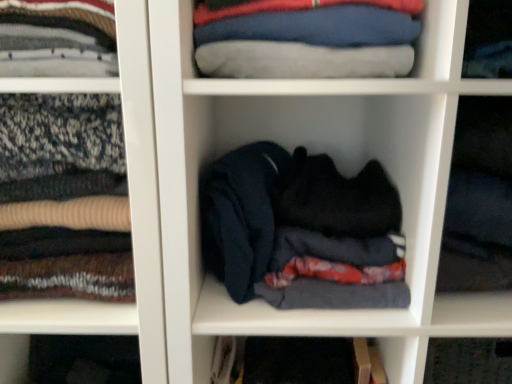
The height and width of the screenshot is (384, 512). Describe the element at coordinates (307, 39) in the screenshot. I see `blue cotton shirt at upper center` at that location.

Locate an element on the screen. This screenshot has height=384, width=512. blue cotton shirt at upper center is located at coordinates (307, 39).

Are black fabric at center, which is counted as the first cabinet, starting from the right, and dark blue fabric at center, which ranks as the 1th cabinet in left-to-right order, located far from each other?

No.

Is point (510, 120) less distant than point (88, 303)?

Yes, it is in front of point (88, 303).

How many degrees apart are the facing directions of black fabric at center, placed as the third cabinet when sorted from left to right, and dark blue fabric at center, which ranks as the 1th cabinet in left-to-right order?

1.63 degrees.

Image resolution: width=512 pixels, height=384 pixels. I want to click on the 1st cabinet behind the dark blue fabric at center, the third cabinet viewed from the right, starting your count from the anchor, so click(479, 199).

From the image's perspective, relative to dark fabric at center, marked as the second cabinet in a left-to-right arrangement, is dark blue fabric at center, which ranks as the 1th cabinet in left-to-right order, above or below?

Clearly, from the image's perspective, dark blue fabric at center, which ranks as the 1th cabinet in left-to-right order, is below dark fabric at center, marked as the second cabinet in a left-to-right arrangement.

Based on the photo, how far apart are dark blue fabric at center, which ranks as the 1th cabinet in left-to-right order, and dark fabric at center, which ranks as the 2th cabinet in right-to-left order?

They are 12.93 inches apart.

Based on the photo, from a real-world perspective, is dark blue fabric at center, which ranks as the 1th cabinet in left-to-right order, above or below dark fabric at center, marked as the second cabinet in a left-to-right arrangement?

Clearly, from a real-world perspective, dark blue fabric at center, which ranks as the 1th cabinet in left-to-right order, is below dark fabric at center, marked as the second cabinet in a left-to-right arrangement.

Which is more to the left, dark fabric at center, marked as the second cabinet in a left-to-right arrangement, or blue cotton shirt at upper center?

blue cotton shirt at upper center is more to the left.

Is dark fabric at center, which ranks as the 2th cabinet in right-to-left order, positioned behind blue cotton shirt at upper center?

Yes, dark fabric at center, which ranks as the 2th cabinet in right-to-left order, is further from the viewer.

Is point (434, 273) positioned behind point (270, 45)?

Yes.

Between dark fabric at center, which ranks as the 2th cabinet in right-to-left order, and blue cotton shirt at upper center, which one has smaller width?

blue cotton shirt at upper center.

Is dark blue fabric at center, the third cabinet viewed from the right, surrounding blue cotton shirt at upper center?

That's incorrect, blue cotton shirt at upper center is not inside dark blue fabric at center, the third cabinet viewed from the right.

Between dark blue fabric at center, the third cabinet viewed from the right, and blue cotton shirt at upper center, which one has more height?

With more height is dark blue fabric at center, the third cabinet viewed from the right.

Does dark blue fabric at center, the third cabinet viewed from the right, lie in front of blue cotton shirt at upper center?

That is True.

In terms of height, does black fabric at center, which is counted as the first cabinet, starting from the right, look taller or shorter compared to dark fabric at center, marked as the second cabinet in a left-to-right arrangement?

In the image, black fabric at center, which is counted as the first cabinet, starting from the right, appears to be taller than dark fabric at center, marked as the second cabinet in a left-to-right arrangement.

Is black fabric at center, placed as the third cabinet when sorted from left to right, far away from dark fabric at center, which ranks as the 2th cabinet in right-to-left order?

black fabric at center, placed as the third cabinet when sorted from left to right, is near dark fabric at center, which ranks as the 2th cabinet in right-to-left order, not far away.

In the scene shown: Does black fabric at center, placed as the third cabinet when sorted from left to right, have a larger size compared to dark fabric at center, which ranks as the 2th cabinet in right-to-left order?

Incorrect, black fabric at center, placed as the third cabinet when sorted from left to right, is not larger than dark fabric at center, which ranks as the 2th cabinet in right-to-left order.

From the picture: From a real-world perspective, who is located lower, black fabric at center, placed as the third cabinet when sorted from left to right, or blue cotton shirt at upper center?

In real-world perspective, black fabric at center, placed as the third cabinet when sorted from left to right, is lower.

How much distance is there between black fabric at center, placed as the third cabinet when sorted from left to right, and blue cotton shirt at upper center?

black fabric at center, placed as the third cabinet when sorted from left to right, is 9.95 inches from blue cotton shirt at upper center.

At what (x,y) coordinates should I click in order to perform the action: click on the 2nd cabinet to the right of the blue cotton shirt at upper center, counting from the anchor's position. Please return your answer as a coordinate pair (x, y). The height and width of the screenshot is (384, 512). Looking at the image, I should click on (479, 199).

Which object is closer to the camera taking this photo, black fabric at center, placed as the third cabinet when sorted from left to right, or blue cotton shirt at upper center?

Positioned in front is black fabric at center, placed as the third cabinet when sorted from left to right.

Between blue cotton shirt at upper center and dark blue fabric at center, which ranks as the 1th cabinet in left-to-right order, which one has less height?

blue cotton shirt at upper center.

Is blue cotton shirt at upper center turned away from dark blue fabric at center, the third cabinet viewed from the right?

→ That's not correct — blue cotton shirt at upper center is not looking away from dark blue fabric at center, the third cabinet viewed from the right.

In the scene shown: Is blue cotton shirt at upper center positioned far away from dark blue fabric at center, which ranks as the 1th cabinet in left-to-right order?

No, blue cotton shirt at upper center is not far away from dark blue fabric at center, which ranks as the 1th cabinet in left-to-right order.

Where is `the 2nd cabinet counting from the right of the dark blue fabric at center, the third cabinet viewed from the right`? the 2nd cabinet counting from the right of the dark blue fabric at center, the third cabinet viewed from the right is located at coordinates (479, 199).

Identify the location of the 1st cabinet above the dark blue fabric at center, which ranks as the 1th cabinet in left-to-right order (from the image's perspective). click(x=347, y=174).

From the picture: Which object lies nearer to the anchor point dark blue fabric at center, which ranks as the 1th cabinet in left-to-right order, blue cotton shirt at upper center or dark fabric at center, which ranks as the 2th cabinet in right-to-left order?

blue cotton shirt at upper center lies closer to dark blue fabric at center, which ranks as the 1th cabinet in left-to-right order, than the other object.

From the picture: From the image, which object appears to be farther from dark blue fabric at center, the third cabinet viewed from the right, dark fabric at center, marked as the second cabinet in a left-to-right arrangement, or blue cotton shirt at upper center?

Based on the image, dark fabric at center, marked as the second cabinet in a left-to-right arrangement, appears to be further to dark blue fabric at center, the third cabinet viewed from the right.

Considering their positions, is black fabric at center, placed as the third cabinet when sorted from left to right, positioned closer to dark fabric at center, which ranks as the 2th cabinet in right-to-left order, than blue cotton shirt at upper center?

Among the two, black fabric at center, placed as the third cabinet when sorted from left to right, is located nearer to dark fabric at center, which ranks as the 2th cabinet in right-to-left order.

From the image, which object appears to be nearer to blue cotton shirt at upper center, black fabric at center, placed as the third cabinet when sorted from left to right, or dark blue fabric at center, which ranks as the 1th cabinet in left-to-right order?

The object closer to blue cotton shirt at upper center is dark blue fabric at center, which ranks as the 1th cabinet in left-to-right order.

Which object lies further to the anchor point blue cotton shirt at upper center, dark fabric at center, which ranks as the 2th cabinet in right-to-left order, or dark blue fabric at center, the third cabinet viewed from the right?

dark blue fabric at center, the third cabinet viewed from the right, is positioned further to the anchor blue cotton shirt at upper center.

Considering their positions, is dark blue fabric at center, the third cabinet viewed from the right, positioned closer to black fabric at center, which is counted as the first cabinet, starting from the right, than blue cotton shirt at upper center?

blue cotton shirt at upper center is closer to black fabric at center, which is counted as the first cabinet, starting from the right.

Looking at the image, which one is located further to blue cotton shirt at upper center, dark blue fabric at center, the third cabinet viewed from the right, or dark fabric at center, marked as the second cabinet in a left-to-right arrangement?

dark blue fabric at center, the third cabinet viewed from the right, is positioned further to the anchor blue cotton shirt at upper center.

Estimate the real-world distances between objects in this image. Which object is closer to black fabric at center, which is counted as the first cabinet, starting from the right, blue cotton shirt at upper center or dark fabric at center, which ranks as the 2th cabinet in right-to-left order?

Based on the image, dark fabric at center, which ranks as the 2th cabinet in right-to-left order, appears to be nearer to black fabric at center, which is counted as the first cabinet, starting from the right.

Identify the location of cabinet between dark blue fabric at center, which ranks as the 1th cabinet in left-to-right order, and black fabric at center, placed as the third cabinet when sorted from left to right. This screenshot has width=512, height=384. (347, 174).

Image resolution: width=512 pixels, height=384 pixels. I want to click on cabinet situated between blue cotton shirt at upper center and black fabric at center, which is counted as the first cabinet, starting from the right, from left to right, so click(347, 174).

Where is `clothing between dark blue fabric at center, which ranks as the 1th cabinet in left-to-right order, and dark fabric at center, marked as the second cabinet in a left-to-right arrangement, from left to right`? The image size is (512, 384). clothing between dark blue fabric at center, which ranks as the 1th cabinet in left-to-right order, and dark fabric at center, marked as the second cabinet in a left-to-right arrangement, from left to right is located at coordinates (307, 39).

Identify the location of clothing situated between dark blue fabric at center, which ranks as the 1th cabinet in left-to-right order, and black fabric at center, placed as the third cabinet when sorted from left to right, from left to right. The height and width of the screenshot is (384, 512). coord(307,39).